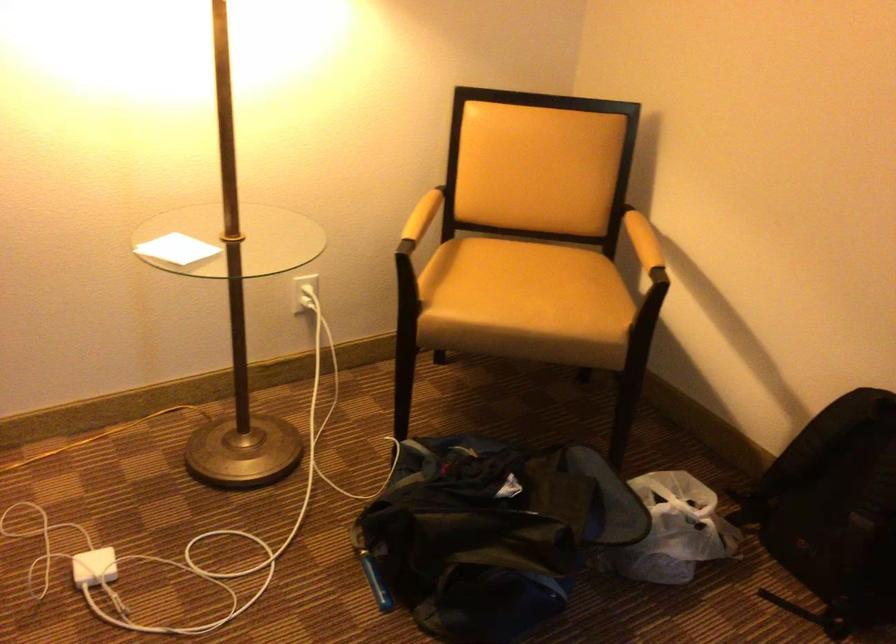
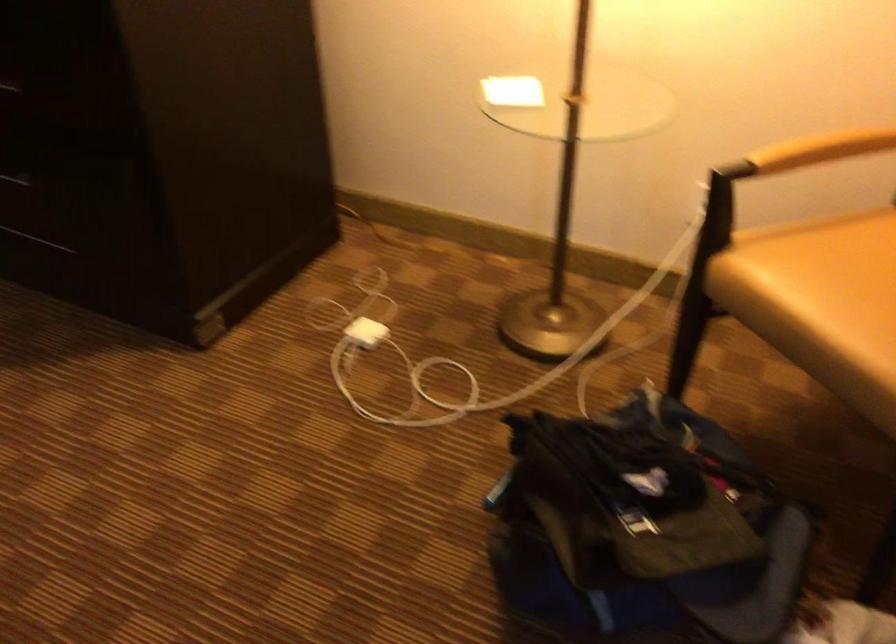
How did the camera likely rotate?

The rotation direction of the camera is left-down.